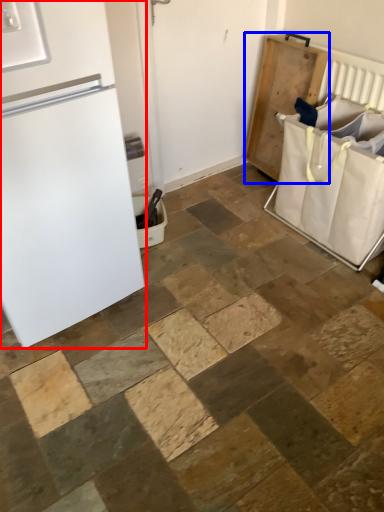
Question: Which object is further to the camera taking this photo, refrigerator (highlighted by a red box) or changing table (highlighted by a blue box)?

Choices:
 (A) refrigerator
 (B) changing table

Answer: (B)